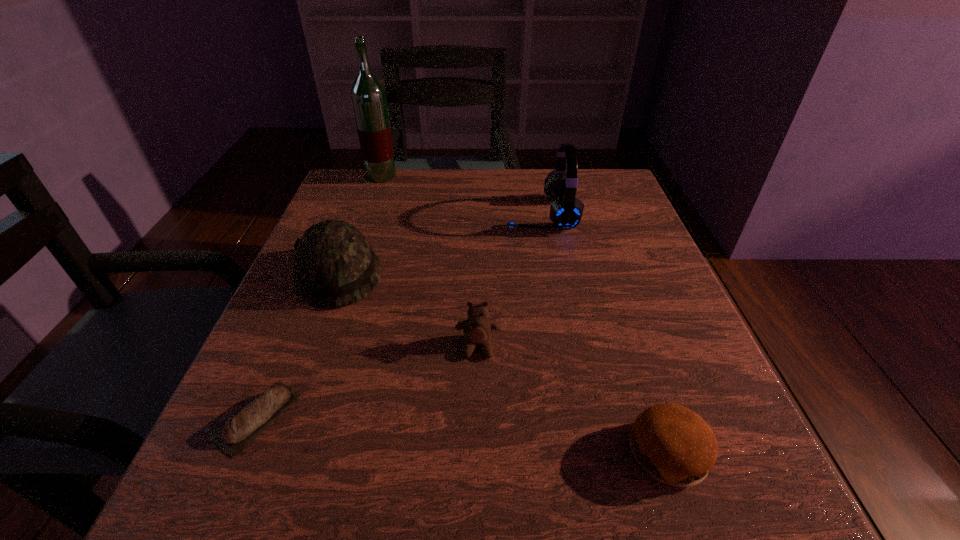
This screenshot has height=540, width=960. In order to click on vacant region at the left edge of the desktop in this screenshot , I will do `click(307, 312)`.

Find the location of `vacant space at the right edge of the desktop`. vacant space at the right edge of the desktop is located at coordinates tap(616, 278).

At what (x,y) coordinates should I click in order to perform the action: click on free space at the near left corner of the desktop. Please return your answer as a coordinate pair (x, y). Looking at the image, I should click on (195, 491).

At what (x,y) coordinates should I click in order to perform the action: click on vacant space at the far right corner. Please return your answer as a coordinate pair (x, y). Looking at the image, I should click on (610, 179).

Where is `vacant space at the near right corner`? vacant space at the near right corner is located at coordinates (721, 500).

In order to click on unoccupied area between the fourth object from left to right and the tallest object in this screenshot , I will do `click(429, 261)`.

The width and height of the screenshot is (960, 540). What are the coordinates of `free spot between the shortest object and the fifth tallest object` in the screenshot? It's located at (464, 435).

This screenshot has width=960, height=540. What are the coordinates of `empty space between the farthest object and the hamburger` in the screenshot? It's located at (525, 314).

At what (x,y) coordinates should I click in order to perform the action: click on vacant space that's between the hamburger and the third nearest object. Please return your answer as a coordinate pair (x, y). Looking at the image, I should click on (573, 400).

At what (x,y) coordinates should I click in order to perform the action: click on free spot between the fifth nearest object and the headwear. Please return your answer as a coordinate pair (x, y). Looking at the image, I should click on (440, 244).